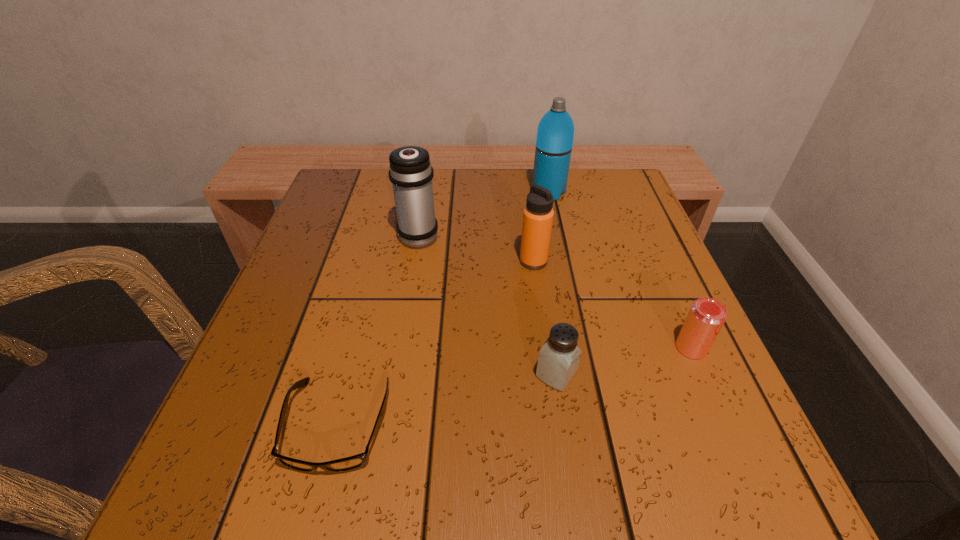
Image resolution: width=960 pixels, height=540 pixels. In order to click on free space located on the side with the handle of the leftmost thermos bottle in this screenshot , I will do `click(428, 178)`.

The width and height of the screenshot is (960, 540). What are the coordinates of `vacant space located 0.220m on the side with the handle of the leftmost thermos bottle` in the screenshot? It's located at (429, 172).

Identify the location of free region located 0.110m on the front of the third farthest object. This screenshot has width=960, height=540. (540, 312).

The width and height of the screenshot is (960, 540). What are the coordinates of `free space located 0.110m on the front of the saltshaker` in the screenshot? It's located at (570, 464).

I want to click on vacant space located 0.060m on the back of the rightmost object, so click(675, 309).

The height and width of the screenshot is (540, 960). What are the coordinates of `object at the near edge` in the screenshot? It's located at (349, 463).

You are a GUI agent. You are given a task and a screenshot of the screen. Output one action in this format:
    pyautogui.click(x=<x>, y=<y>)
    Task: Click on the object that is at the left edge
    The image size is (960, 540).
    Given the screenshot: What is the action you would take?
    pyautogui.click(x=349, y=463)

This screenshot has height=540, width=960. Find the location of `object present at the right edge`. object present at the right edge is located at coordinates (706, 316).

The width and height of the screenshot is (960, 540). In order to click on object that is at the near left corner in this screenshot , I will do `click(349, 463)`.

This screenshot has height=540, width=960. I want to click on free space at the far edge of the desktop, so click(x=450, y=201).